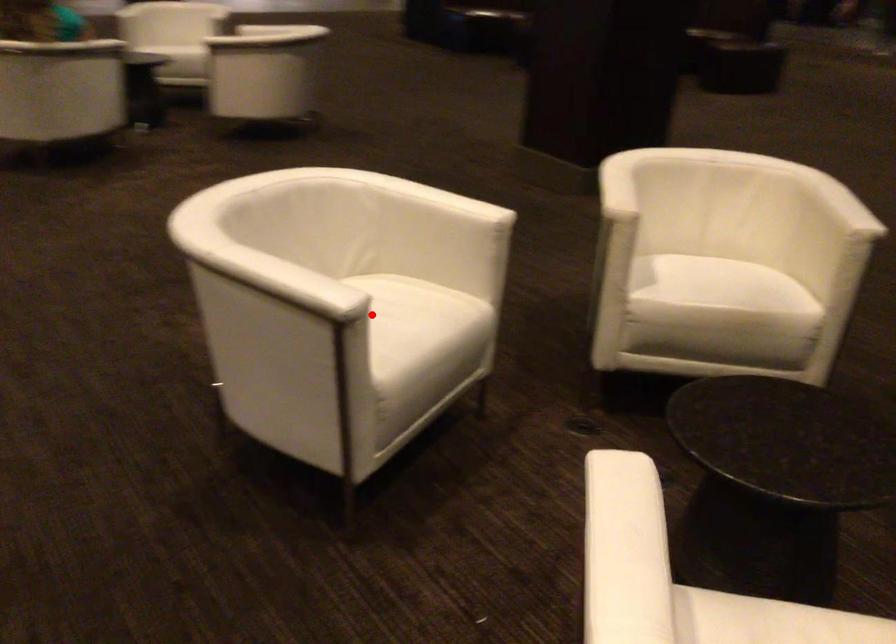
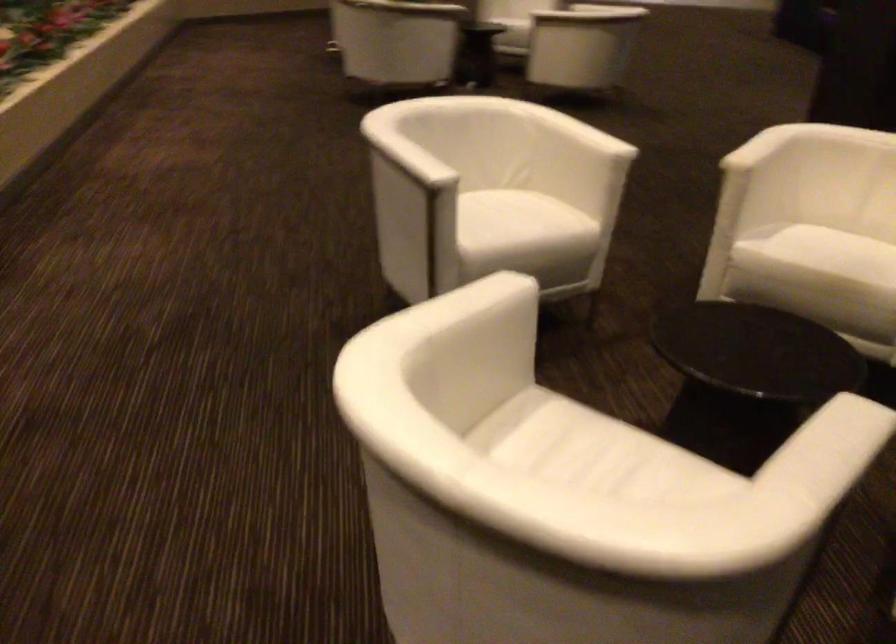
Find the pixel in the second image that matches the highlighted location in the first image.

(502, 214)